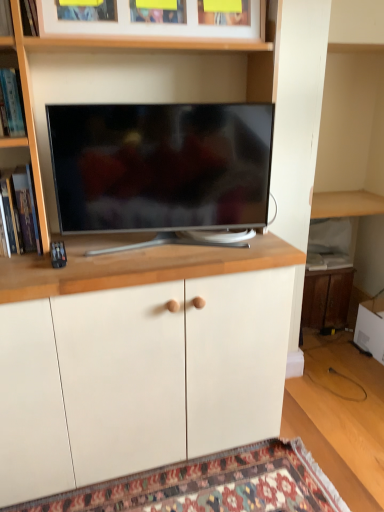
The image size is (384, 512). I want to click on vacant space situated above wooden cabinet at lower right, which ranks as the 2th cabinetry in left-to-right order (from a real-world perspective), so click(x=329, y=262).